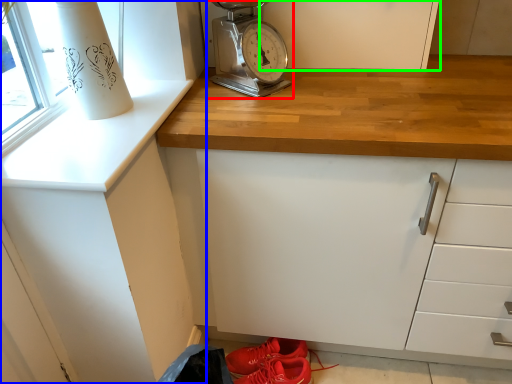
Question: Which is nearer to the home appliance (highlighted by a red box)? cabinetry (highlighted by a blue box) or cabinetry (highlighted by a green box).

Choices:
 (A) cabinetry
 (B) cabinetry

Answer: (B)